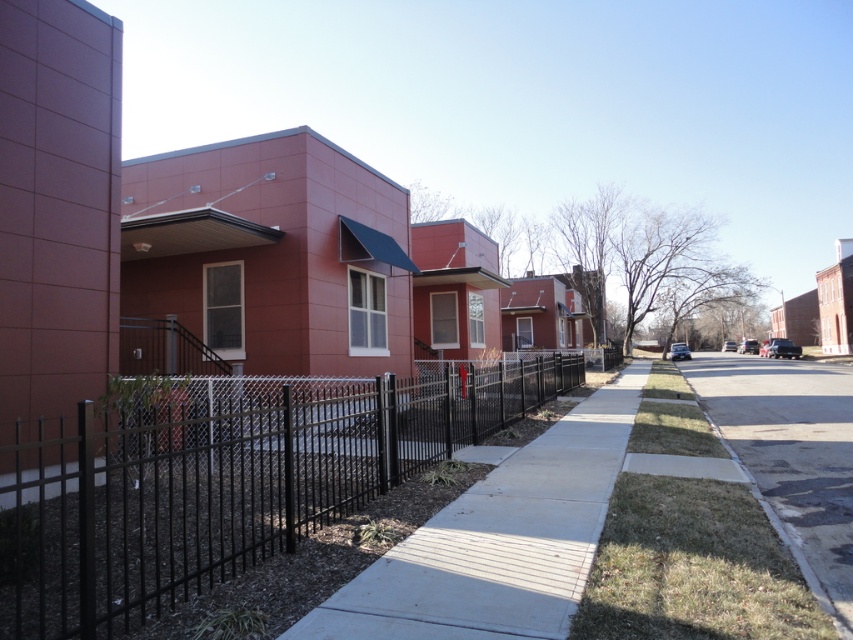
You are a delivery person standing at the camera position. You need to place a package on the sidewalk. The sidewalk is 2.5 meters wide. The black metal fence at center is in the way. Can you walk around it to place the package on the sidewalk?

The black metal fence at center is 3.02 meters away from the camera. Since the sidewalk is 2.5 meters wide, the fence is further away than the sidewalk width, so you can walk around it to place the package on the sidewalk.